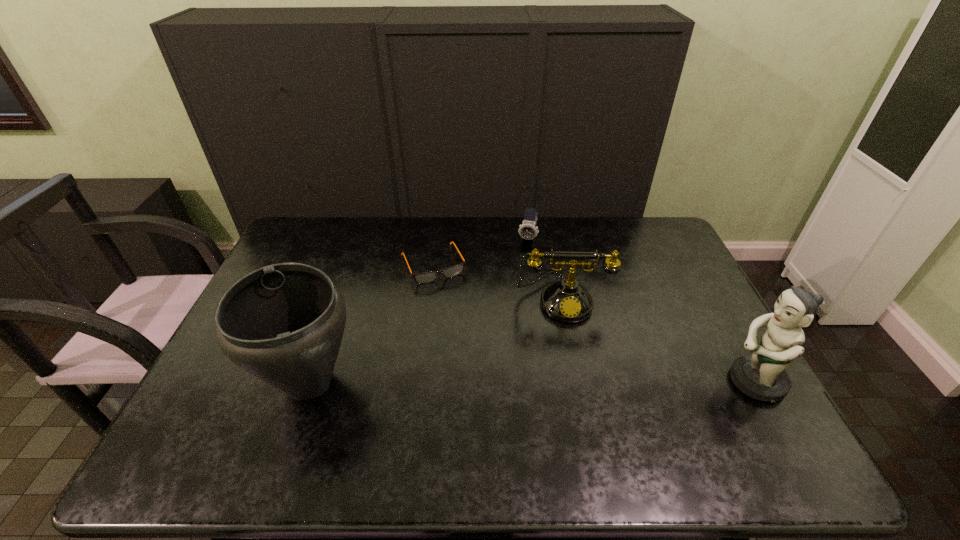
In the image, there is a desktop. Where is `vacant space at the right edge`? The height and width of the screenshot is (540, 960). vacant space at the right edge is located at coordinates (718, 347).

The image size is (960, 540). Find the location of `free location at the far left corner`. free location at the far left corner is located at coordinates click(x=334, y=235).

Locate an element on the screen. This screenshot has width=960, height=540. blank space at the near right corner of the desktop is located at coordinates (714, 403).

Image resolution: width=960 pixels, height=540 pixels. In order to click on vacant region between the fourth tallest object and the second object from left to right in this screenshot , I will do `click(480, 251)`.

At what (x,y) coordinates should I click in order to perform the action: click on free spot between the spectacles and the rightmost object. Please return your answer as a coordinate pair (x, y). Image resolution: width=960 pixels, height=540 pixels. Looking at the image, I should click on (593, 323).

The image size is (960, 540). In order to click on free area in between the figurine and the urn in this screenshot , I will do `click(532, 381)`.

Where is `free space between the third shortest object and the watch`? This screenshot has height=540, width=960. free space between the third shortest object and the watch is located at coordinates (544, 269).

Find the location of a particular element. This screenshot has height=540, width=960. blank region between the leftmost object and the third tallest object is located at coordinates (436, 340).

You are a GUI agent. You are given a task and a screenshot of the screen. Output one action in this format:
    pyautogui.click(x=<x>, y=<y>)
    Task: Click on the free point between the rightmost object and the watch
    
    Given the screenshot: What is the action you would take?
    pyautogui.click(x=640, y=310)

Locate an element on the screen. This screenshot has width=960, height=540. empty location between the watch and the rightmost object is located at coordinates (640, 310).